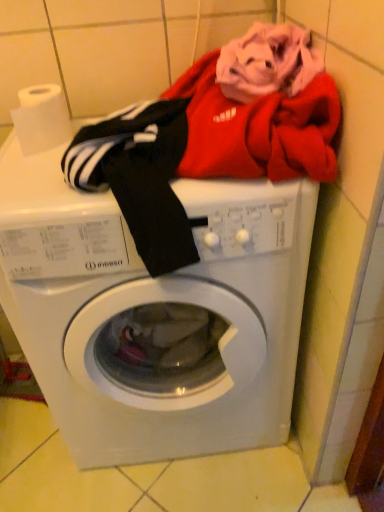
The image size is (384, 512). Identify the location of vacant area in front of white matte toilet paper at upper left. (36, 182).